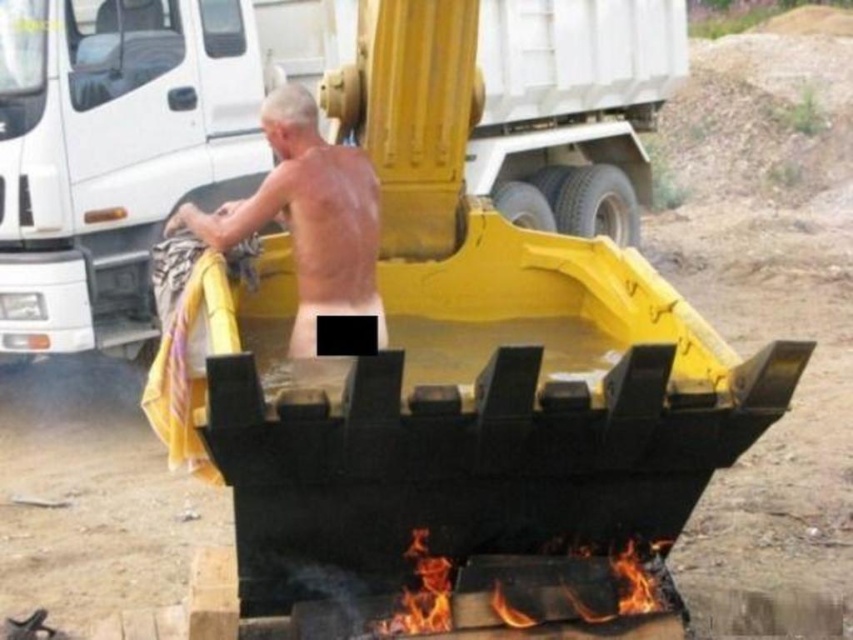
You are a safety inspector reviewing this construction site image. You notice the metallic yellow excavator bucket at center and the shiny metallic man at center. Based on their heights, which object is shorter?

The metallic yellow excavator bucket at center is shorter than the shiny metallic man at center.

You are a safety inspector reviewing this construction site image. You notice the shiny metallic man at center and the flaming wood at lower center. Based on their sizes, which object would you prioritize inspecting for potential safety hazards?

The shiny metallic man at center has a smaller width than the flaming wood at lower center, so the inspector should prioritize inspecting the shiny metallic man at center due to its smaller size potentially posing a higher risk of being overlooked or causing accidents.

You are a safety inspector evaluating this construction site. You notice the metallic yellow excavator bucket at center and the flaming wood at lower center. Based on their widths, which object is narrower?

Answer: The metallic yellow excavator bucket at center has a lesser width compared to flaming wood at lower center, so the metallic yellow excavator bucket at center is narrower.